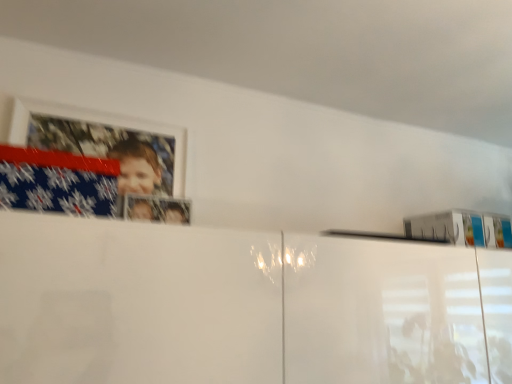
Question: From the image's perspective, does white glossy picture frame at upper left appear lower than blue fabric flag at upper left?

Choices:
 (A) yes
 (B) no

Answer: (B)

Question: Does white glossy picture frame at upper left contain blue fabric flag at upper left?

Choices:
 (A) no
 (B) yes

Answer: (A)

Question: Considering the relative sizes of white glossy picture frame at upper left and blue fabric flag at upper left in the image provided, is white glossy picture frame at upper left taller than blue fabric flag at upper left?

Choices:
 (A) yes
 (B) no

Answer: (A)

Question: Is white glossy picture frame at upper left not within blue fabric flag at upper left?

Choices:
 (A) no
 (B) yes

Answer: (B)

Question: Does white glossy picture frame at upper left have a smaller size compared to blue fabric flag at upper left?

Choices:
 (A) no
 (B) yes

Answer: (B)

Question: Could you tell me if white glossy picture frame at upper left is facing blue fabric flag at upper left?

Choices:
 (A) yes
 (B) no

Answer: (B)

Question: Is blue fabric flag at upper left further to camera compared to white glossy picture frame at upper left?

Choices:
 (A) no
 (B) yes

Answer: (A)

Question: Could you tell me if blue fabric flag at upper left is turned towards white glossy picture frame at upper left?

Choices:
 (A) no
 (B) yes

Answer: (A)

Question: From a real-world perspective, is blue fabric flag at upper left below white glossy picture frame at upper left?

Choices:
 (A) yes
 (B) no

Answer: (A)

Question: From a real-world perspective, does blue fabric flag at upper left stand above white glossy picture frame at upper left?

Choices:
 (A) no
 (B) yes

Answer: (A)

Question: Does blue fabric flag at upper left have a lesser height compared to white glossy picture frame at upper left?

Choices:
 (A) no
 (B) yes

Answer: (B)

Question: Is blue fabric flag at upper left wider than white glossy picture frame at upper left?

Choices:
 (A) no
 (B) yes

Answer: (B)

Question: Is point (78, 213) positioned closer to the camera than point (32, 167)?

Choices:
 (A) closer
 (B) farther

Answer: (A)